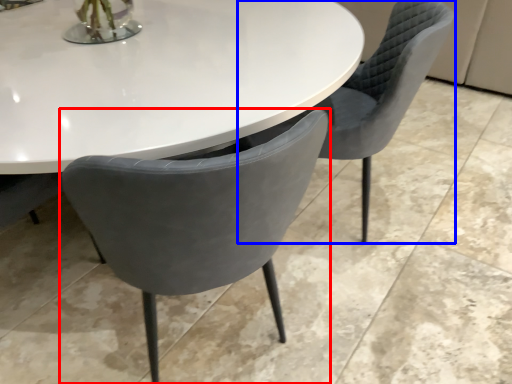
Question: Which of the following is the farthest to the observer, chair (highlighted by a red box) or chair (highlighted by a blue box)?

Choices:
 (A) chair
 (B) chair

Answer: (B)